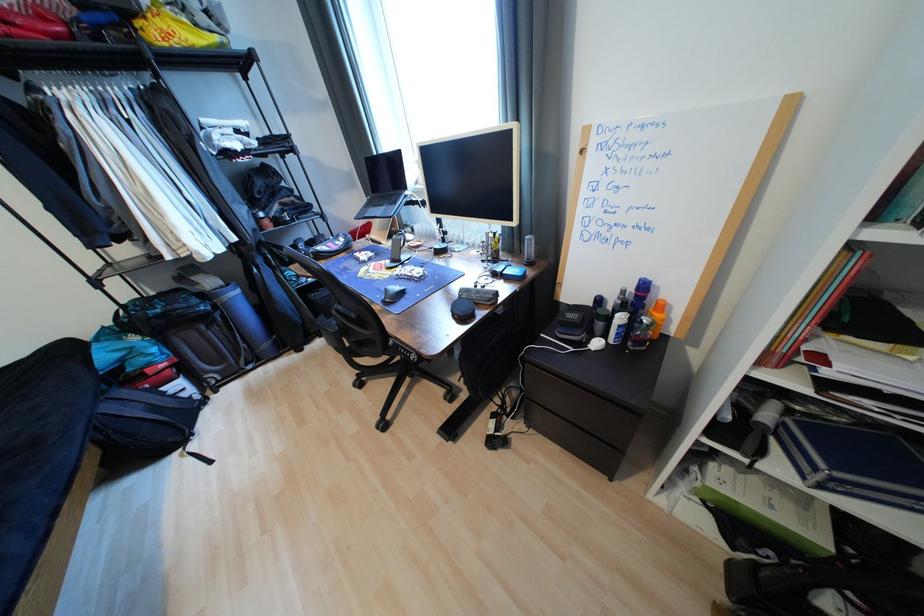
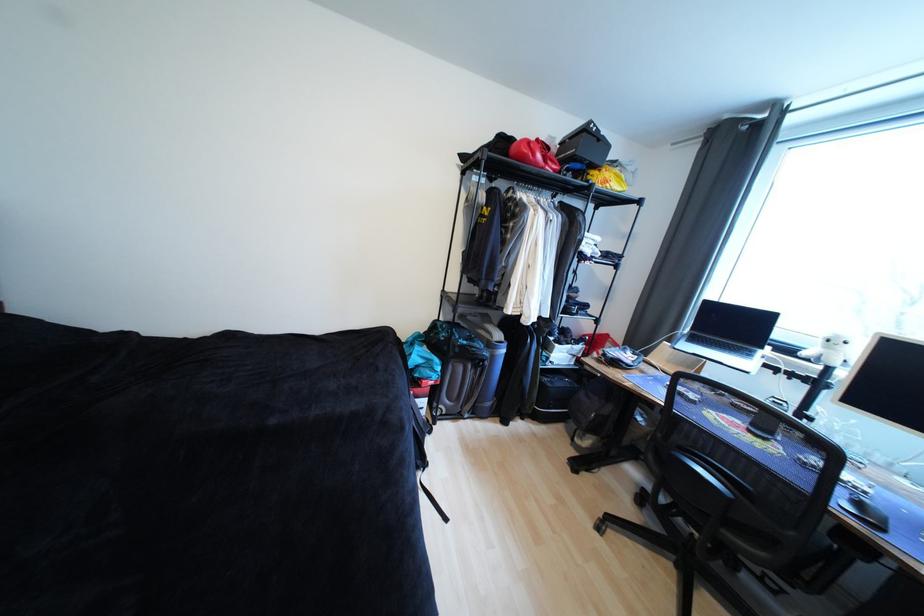
Where in the second image is the point corresponding to pixel 166 317 from the first image?

(469, 347)